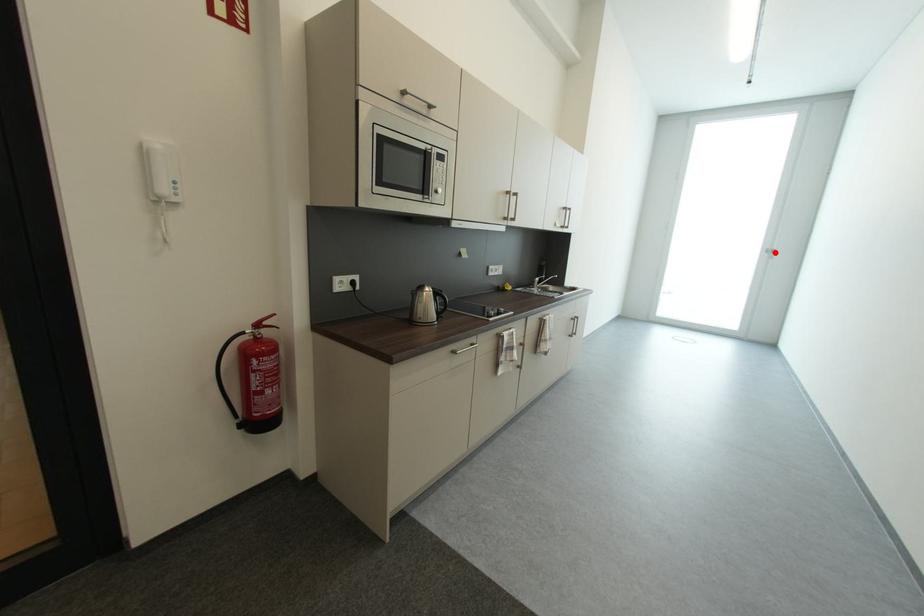
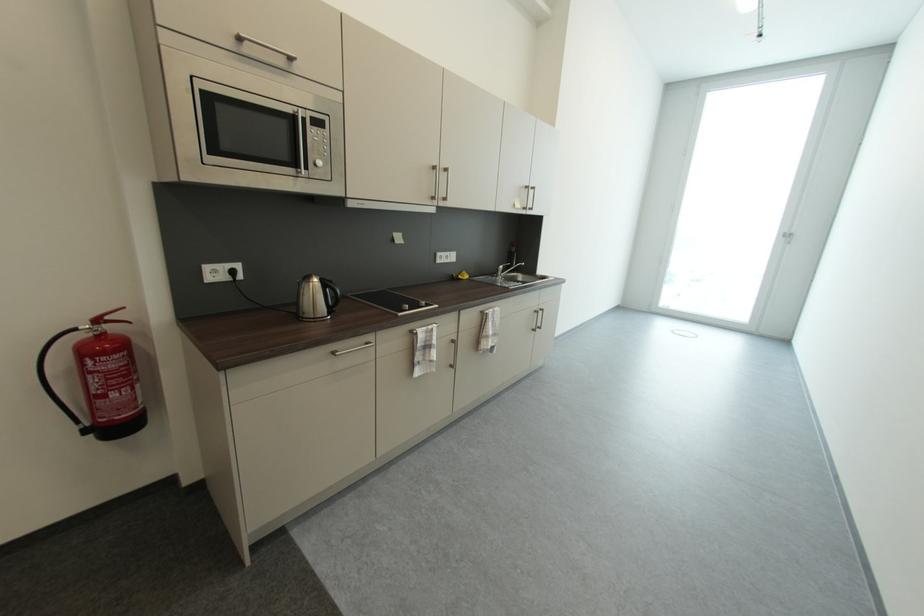
In the second image, find the point that corresponds to the highlighted location in the first image.

(794, 238)